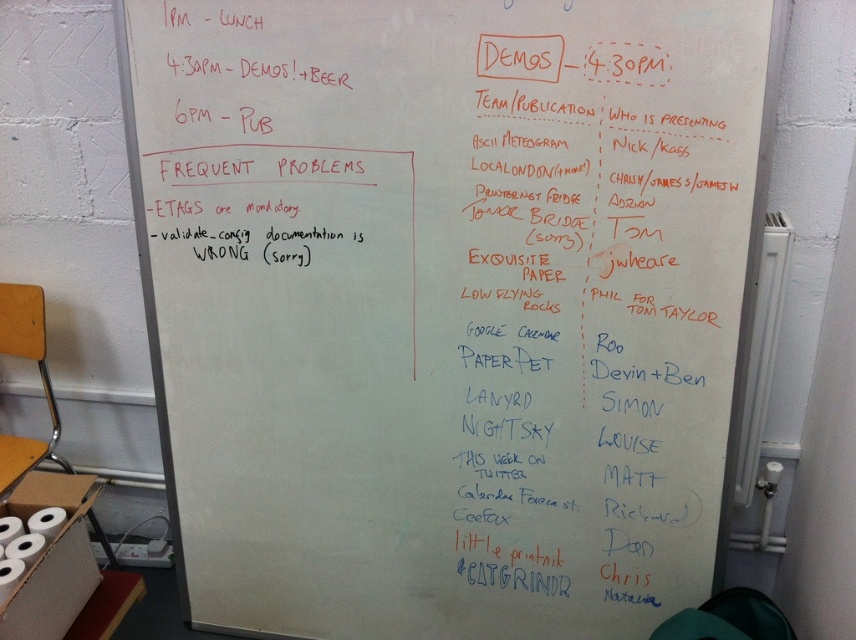
You are standing in front of the whiteboard and want to see both the orange marker text at upper center and the white matte toilet paper at lower left. Which object will you need to look past the other to see?

You will need to look past the orange marker text at upper center to see the white matte toilet paper at lower left because the orange marker text at upper center is in front of it.

You are organizing a meeting and need to place a 1.2 meter long banner between the orange marker text at upper center and the white matte toilet paper at lower left. Will there be enough space?

The distance between the orange marker text at upper center and the white matte toilet paper at lower left is 1.30 meters. Since the banner is 1.2 meters long, it will fit with 0.1 meters of space remaining.

You are organizing a meeting and need to check the schedule on the whiteboard. The orange marker text at upper center and the white matte toilet paper at lower left are both visible. Which one has a larger size?

The white matte toilet paper at lower left is larger than the orange marker text at upper center.